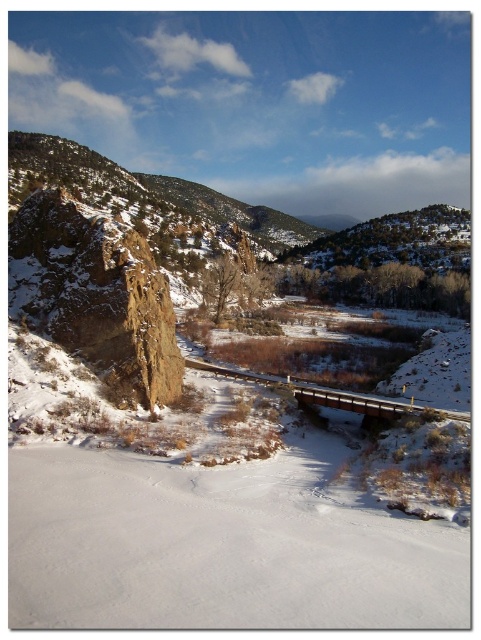
Can you confirm if brown rough rock at left is smaller than brown wooden bridge at center?

No.

Who is shorter, brown rough rock at left or brown wooden bridge at center?

brown wooden bridge at center

The image size is (481, 640). Describe the element at coordinates (96, 296) in the screenshot. I see `brown rough rock at left` at that location.

Locate an element on the screen. The image size is (481, 640). brown rough rock at left is located at coordinates (96, 296).